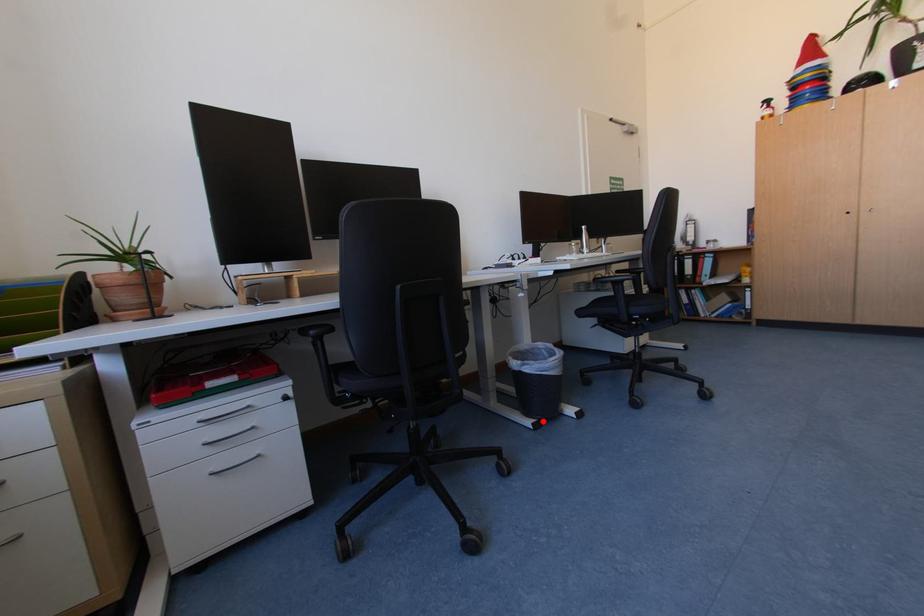
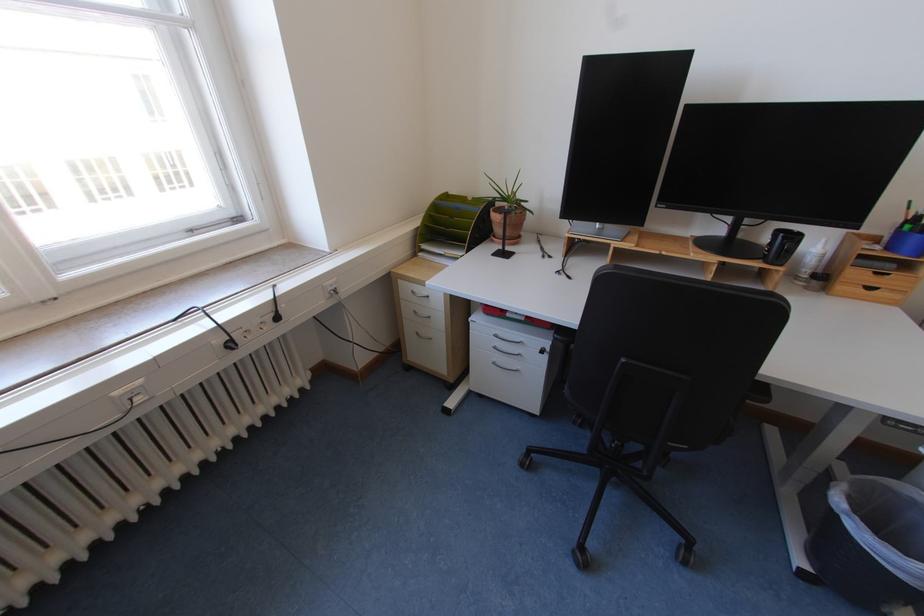
In the second image, find the point that corresponds to the highlighted location in the first image.

(819, 572)